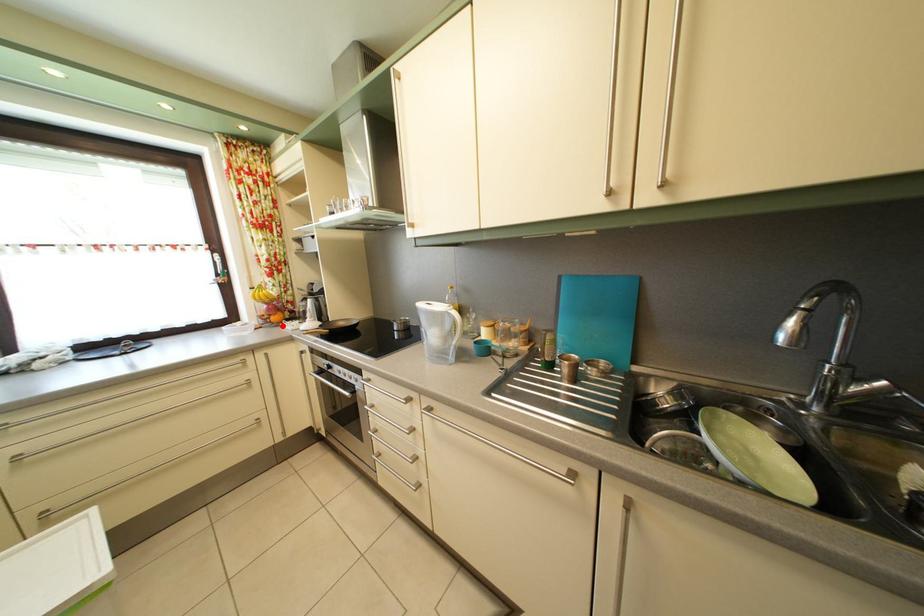
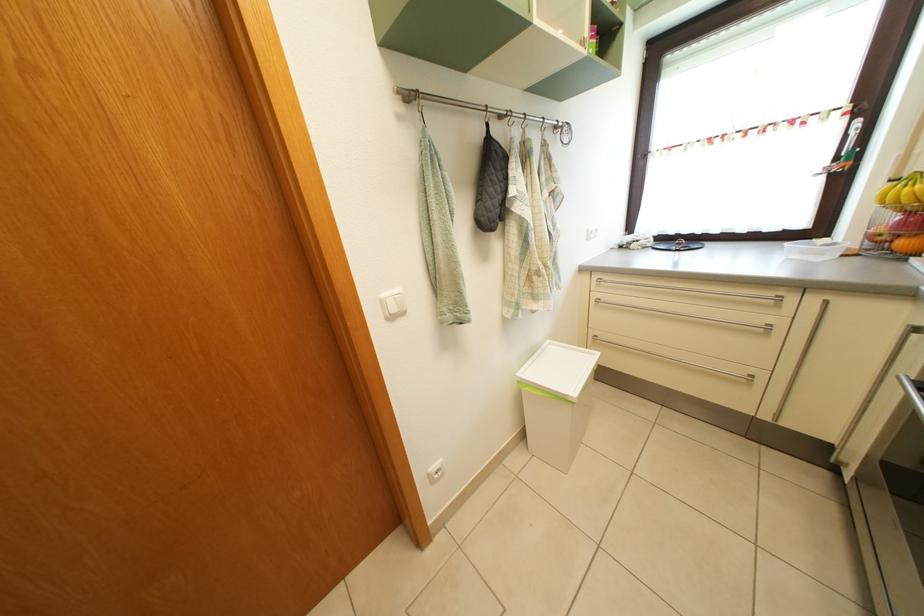
Where in the second image is the point corresponding to the highlighted location from the first image?

(910, 252)